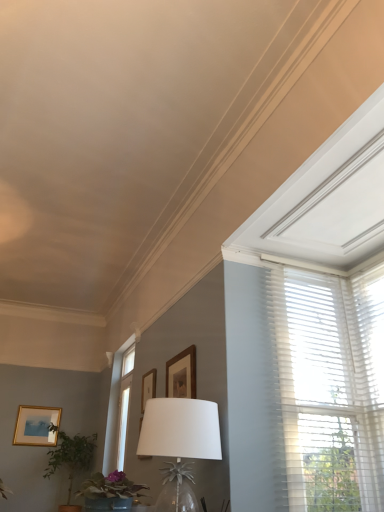
Question: Does white glass table lamp at center have a lesser width compared to matte gold picture frame at lower left, which is counted as the first picture frame, starting from the left?

Choices:
 (A) no
 (B) yes

Answer: (A)

Question: From the image's perspective, does white glass table lamp at center appear lower than matte gold picture frame at lower left, arranged as the first picture frame when viewed from the back?

Choices:
 (A) yes
 (B) no

Answer: (B)

Question: From the image's perspective, is white glass table lamp at center over matte gold picture frame at lower left, the 3th picture frame when ordered from right to left?

Choices:
 (A) yes
 (B) no

Answer: (A)

Question: Is white glass table lamp at center next to matte gold picture frame at lower left, the 3th picture frame when ordered from right to left?

Choices:
 (A) yes
 (B) no

Answer: (B)

Question: Is white glass table lamp at center not within matte gold picture frame at lower left, placed as the 3th picture frame when sorted from top to bottom?

Choices:
 (A) no
 (B) yes

Answer: (B)

Question: Considering the positions of green leafy plant at lower left, the 2th houseplant viewed from the right, and white sheer blinds at upper right in the image, is green leafy plant at lower left, the 2th houseplant viewed from the right, wider or thinner than white sheer blinds at upper right?

Choices:
 (A) wide
 (B) thin

Answer: (A)

Question: Is green leafy plant at lower left, the 2th houseplant viewed from the right, bigger or smaller than white sheer blinds at upper right?

Choices:
 (A) big
 (B) small

Answer: (A)

Question: Is green leafy plant at lower left, acting as the 2th houseplant starting from the front, spatially inside white sheer blinds at upper right, or outside of it?

Choices:
 (A) outside
 (B) inside

Answer: (A)

Question: Considering the positions of point (49, 475) and point (357, 375), is point (49, 475) closer or farther from the camera than point (357, 375)?

Choices:
 (A) closer
 (B) farther

Answer: (B)

Question: From a real-world perspective, relative to wooden picture frame at upper center, arranged as the 3th picture frame when viewed from the left, is wooden picture frame at upper center, arranged as the 2th picture frame when viewed from the front, vertically above or below?

Choices:
 (A) below
 (B) above

Answer: (B)

Question: Considering the positions of wooden picture frame at upper center, which is the second picture frame in left-to-right order, and wooden picture frame at upper center, marked as the 1th picture frame in a front-to-back arrangement, in the image, is wooden picture frame at upper center, which is the second picture frame in left-to-right order, bigger or smaller than wooden picture frame at upper center, marked as the 1th picture frame in a front-to-back arrangement,?

Choices:
 (A) small
 (B) big

Answer: (A)

Question: Which is correct: wooden picture frame at upper center, arranged as the second picture frame when viewed from the top, is inside wooden picture frame at upper center, the 1th picture frame positioned from the right, or outside of it?

Choices:
 (A) inside
 (B) outside

Answer: (B)

Question: From the image's perspective, is wooden picture frame at upper center, marked as the second picture frame in a bottom-to-top arrangement, located above or below wooden picture frame at upper center, the 1th picture frame positioned from the right?

Choices:
 (A) below
 (B) above

Answer: (A)

Question: From their relative heights in the image, would you say white glass table lamp at center is taller or shorter than wooden picture frame at upper center, the second picture frame from the right?

Choices:
 (A) short
 (B) tall

Answer: (B)

Question: Considering the positions of white glass table lamp at center and wooden picture frame at upper center, arranged as the second picture frame when viewed from the top, in the image, is white glass table lamp at center bigger or smaller than wooden picture frame at upper center, arranged as the second picture frame when viewed from the top,?

Choices:
 (A) small
 (B) big

Answer: (B)